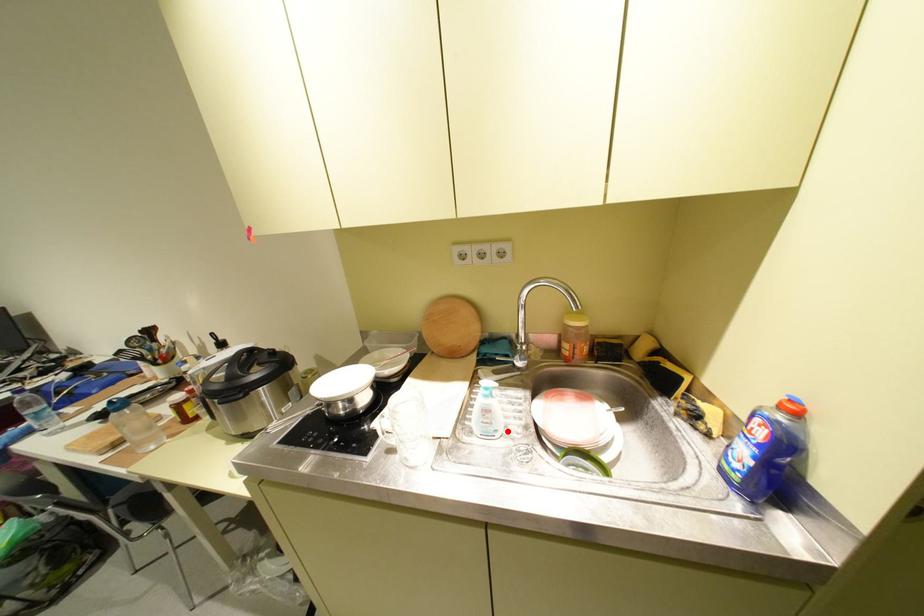
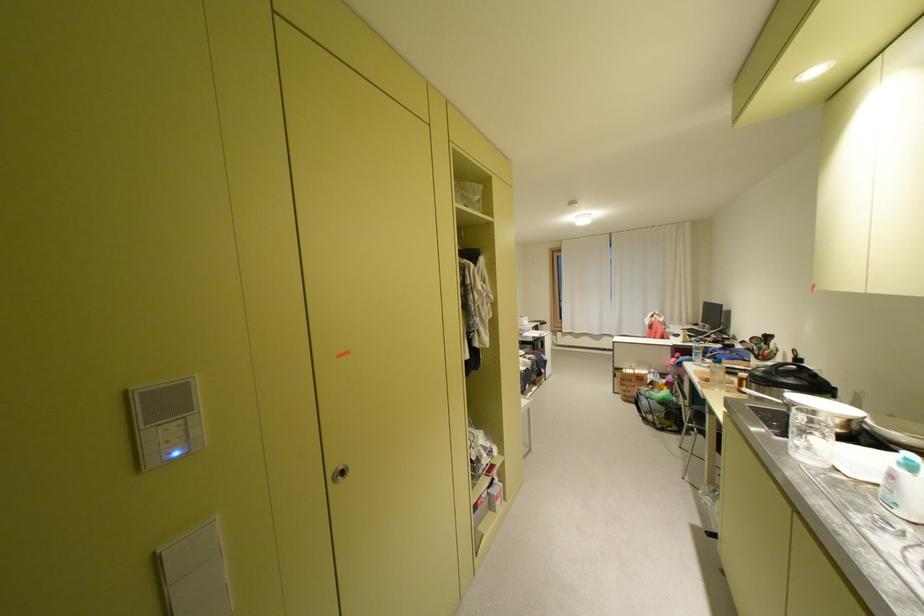
Find the pixel in the second image that matches the highlighted location in the first image.

(906, 505)